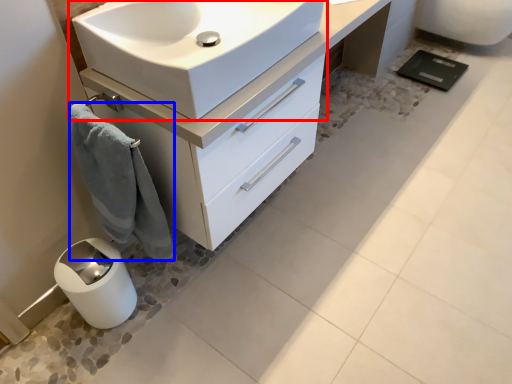
Question: Which point is further to the camera, sink (highlighted by a red box) or bath towel (highlighted by a blue box)?

Choices:
 (A) sink
 (B) bath towel

Answer: (B)